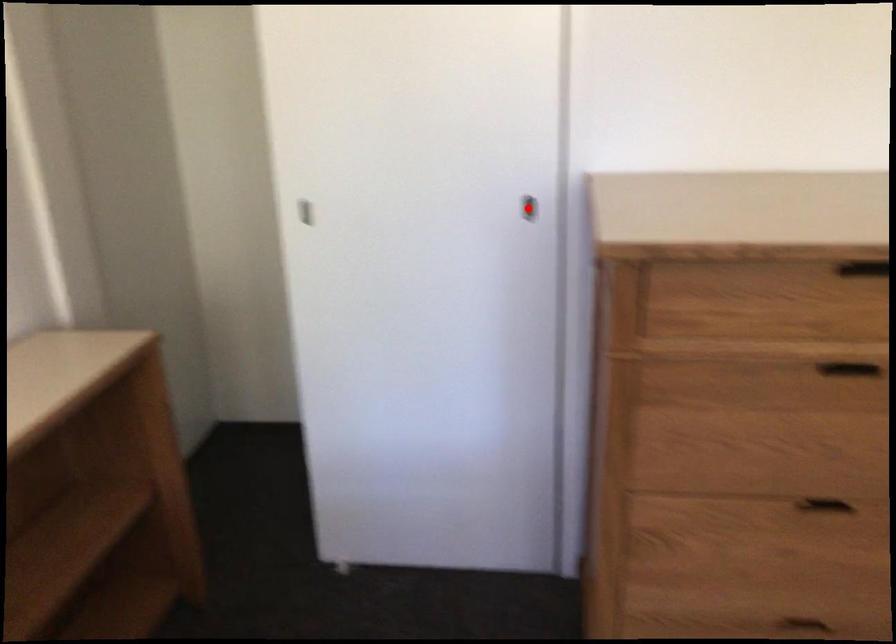
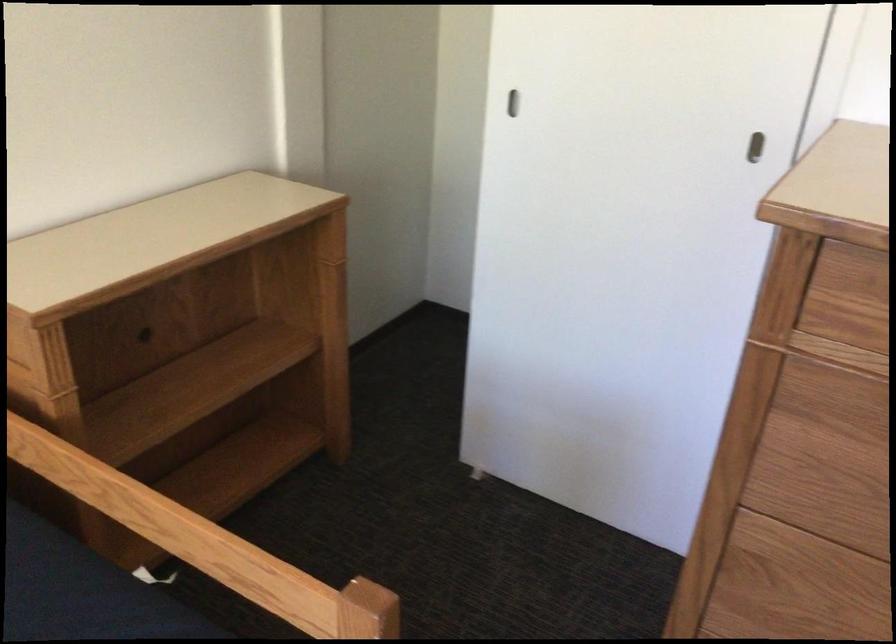
Question: I am providing you with two images of the same scene from different viewpoints. In image1, a red point is highlighted. Considering the same 3D point in image2, which of the following is correct?

Choices:
 (A) It is closer
 (B) It is farther

Answer: (A)